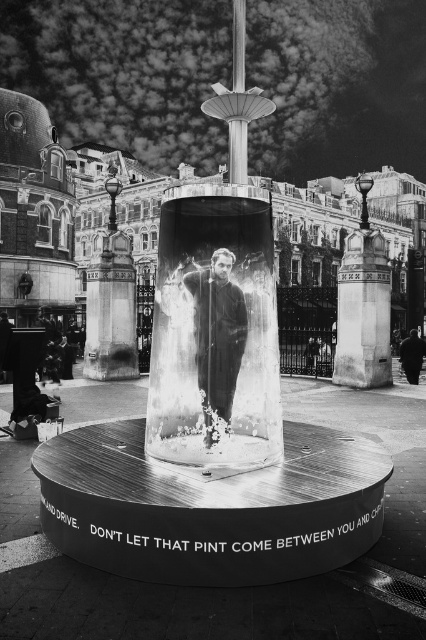
Question: Which is farther from the transparent glass cylinder at center?

Choices:
 (A) smooth black suit at center
 (B) dark fabric jacket at lower right

Answer: (B)

Question: Can you confirm if transparent glass cylinder at center is positioned to the left of smooth black suit at center?

Choices:
 (A) yes
 (B) no

Answer: (A)

Question: Can you confirm if transparent glass cylinder at center is positioned to the right of smooth black suit at center?

Choices:
 (A) no
 (B) yes

Answer: (A)

Question: Which point is closer to the camera?

Choices:
 (A) smooth black suit at center
 (B) dark fabric jacket at lower right
 (C) transparent glass cylinder at center

Answer: (C)

Question: Considering the relative positions of transparent glass cylinder at center and smooth black suit at center in the image provided, where is transparent glass cylinder at center located with respect to smooth black suit at center?

Choices:
 (A) above
 (B) below

Answer: (A)

Question: Among these points, which one is nearest to the camera?

Choices:
 (A) (209, 273)
 (B) (412, 384)
 (C) (166, 212)

Answer: (A)